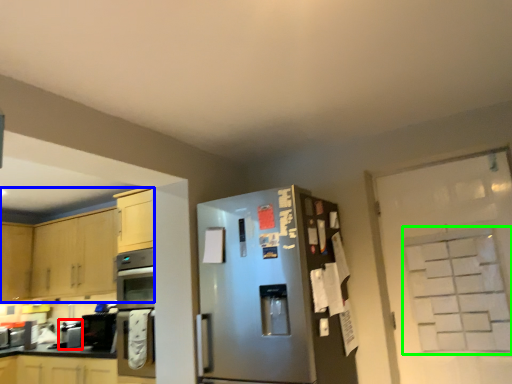
Question: Considering the real-world distances, which object is farthest from appliance (highlighted by a red box)? cabinetry (highlighted by a blue box) or glass door (highlighted by a green box)?

Choices:
 (A) cabinetry
 (B) glass door

Answer: (B)